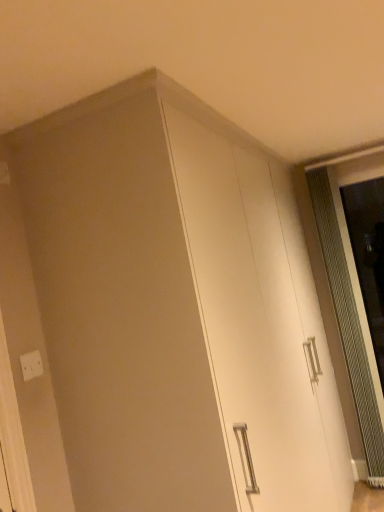
Question: Is clear glass screen door at right in front of or behind white plastic electric outlet at lower left in the image?

Choices:
 (A) behind
 (B) front

Answer: (A)

Question: From the image's perspective, relative to white plastic electric outlet at lower left, is clear glass screen door at right above or below?

Choices:
 (A) below
 (B) above

Answer: (B)

Question: Based on their relative distances, which object is farther from the white plastic electric outlet at lower left?

Choices:
 (A) clear glass screen door at right
 (B) white glossy cabinet at center

Answer: (A)

Question: Which of these objects is positioned farthest from the white glossy cabinet at center?

Choices:
 (A) white plastic electric outlet at lower left
 (B) clear glass screen door at right

Answer: (A)